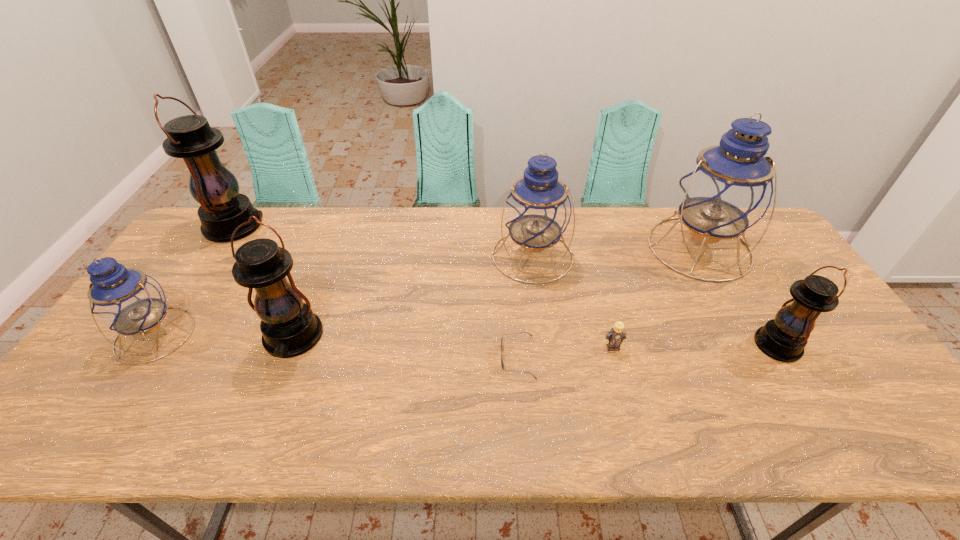
Locate an element on the screen. unoccupied position between the third lantern from right to left and the third object from left to right is located at coordinates (413, 296).

At what (x,y) coordinates should I click in order to perform the action: click on free spot between the second biggest black lantern and the rightmost black lantern. Please return your answer as a coordinate pair (x, y). Image resolution: width=960 pixels, height=540 pixels. Looking at the image, I should click on (535, 341).

Where is `object that ranks as the seventh closest to the shortest object`? The height and width of the screenshot is (540, 960). object that ranks as the seventh closest to the shortest object is located at coordinates (223, 209).

Identify which object is the sixth nearest to the second smallest black lantern. Please provide its 2D coordinates. Your answer should be formatted as a tuple, i.e. [(x, y)], where the tuple contains the x and y coordinates of a point satisfying the conditions above.

[(730, 186)]

Locate which lantern is the closest to the biggest blue lantern. Please provide its 2D coordinates. Your answer should be formatted as a tuple, i.e. [(x, y)], where the tuple contains the x and y coordinates of a point satisfying the conditions above.

[(784, 338)]

Point out which lantern is positioned as the second nearest to the second biggest blue lantern. Please provide its 2D coordinates. Your answer should be formatted as a tuple, i.e. [(x, y)], where the tuple contains the x and y coordinates of a point satisfying the conditions above.

[(784, 338)]

You are a GUI agent. You are given a task and a screenshot of the screen. Output one action in this format:
    pyautogui.click(x=<x>, y=<y>)
    Task: Click on the black lantern that is the second closest to the second blue lantern from left to right
    This screenshot has height=540, width=960.
    Given the screenshot: What is the action you would take?
    pyautogui.click(x=289, y=327)

Locate which black lantern is the closest to the sunglasses. Please provide its 2D coordinates. Your answer should be formatted as a tuple, i.e. [(x, y)], where the tuple contains the x and y coordinates of a point satisfying the conditions above.

[(289, 327)]

Locate an element on the screen. This screenshot has width=960, height=540. blue lantern that stands as the second closest to the biggest blue lantern is located at coordinates (124, 299).

Select which blue lantern appears as the second closest to the rightmost blue lantern. Please provide its 2D coordinates. Your answer should be formatted as a tuple, i.e. [(x, y)], where the tuple contains the x and y coordinates of a point satisfying the conditions above.

[(124, 299)]